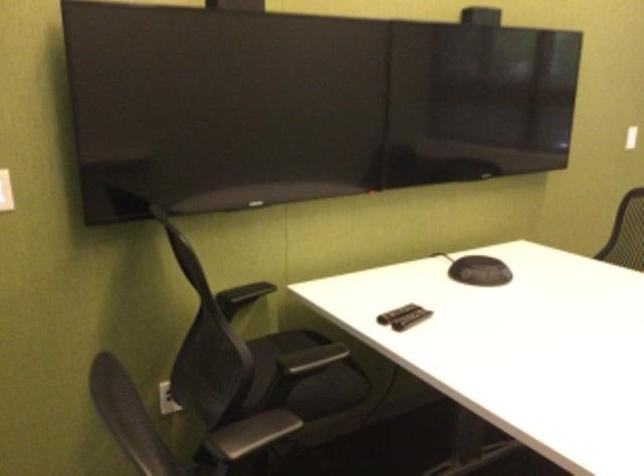
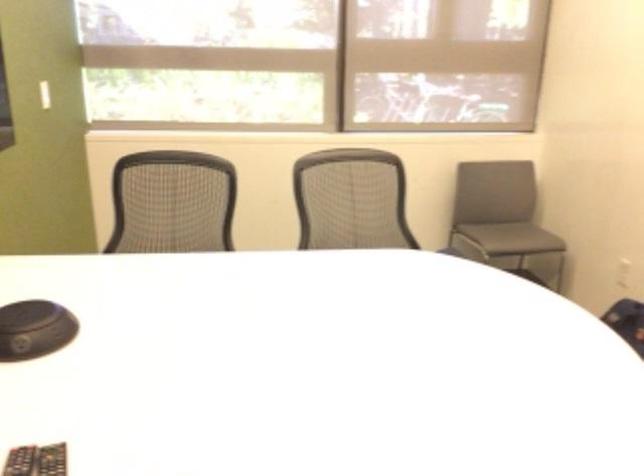
Question: The camera is either moving clockwise (left) or counter-clockwise (right) around the object. The first image is from the beginning of the video and the second image is from the end. Is the camera moving left or right when shooting the video?

Choices:
 (A) Left
 (B) Right

Answer: (A)